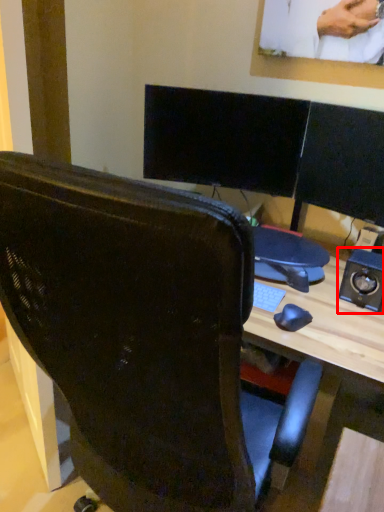
Question: Where is speaker (annotated by the red box) located in relation to chair in the image?

Choices:
 (A) right
 (B) left

Answer: (A)